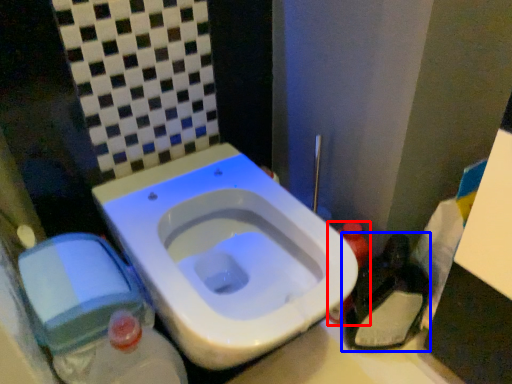
Question: Which object appears closest to the camera in this image, bottle (highlighted by a red box) or garbage (highlighted by a blue box)?

Choices:
 (A) bottle
 (B) garbage

Answer: (B)